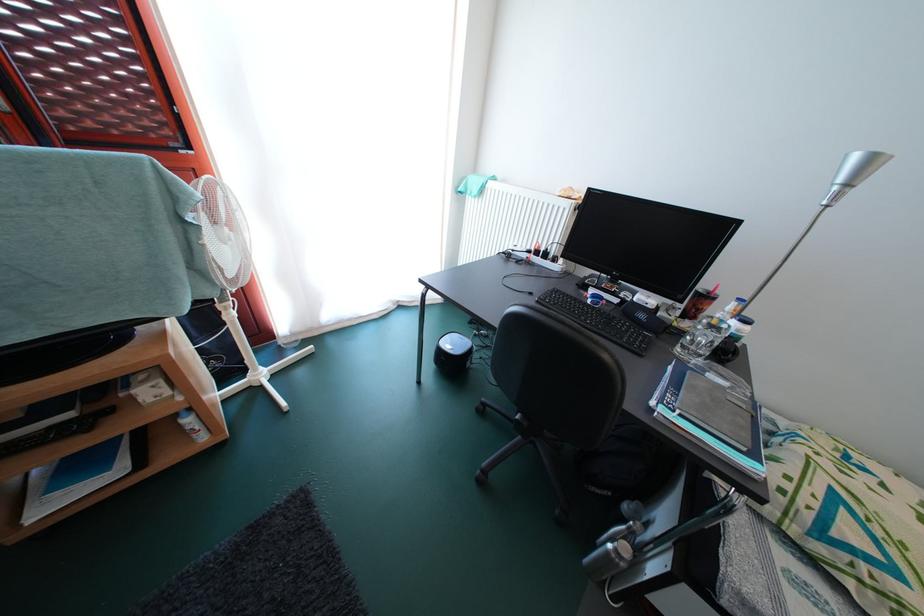
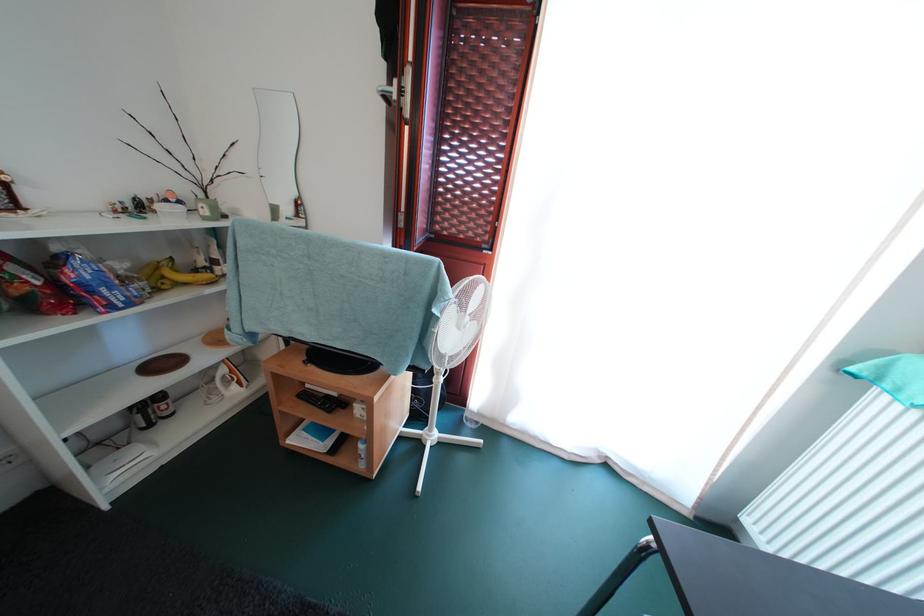
Find the pixel in the second image that matches point 188,432 in the first image.

(363, 453)